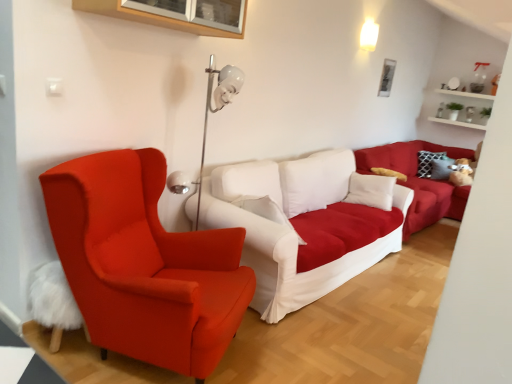
Question: From the image's perspective, does white fabric couch at center, acting as the 2th studio couch starting from the front, appear lower than white wooden shelf at upper right?

Choices:
 (A) no
 (B) yes

Answer: (B)

Question: Does white fabric couch at center, acting as the 2th studio couch starting from the front, have a lesser height compared to white wooden shelf at upper right?

Choices:
 (A) no
 (B) yes

Answer: (A)

Question: Does white fabric couch at center, acting as the 2th studio couch starting from the front, have a greater width compared to white wooden shelf at upper right?

Choices:
 (A) yes
 (B) no

Answer: (A)

Question: Is white fabric couch at center, acting as the 2th studio couch starting from the front, smaller than white wooden shelf at upper right?

Choices:
 (A) no
 (B) yes

Answer: (A)

Question: Could you tell me if white fabric couch at center, the 1th studio couch from the back, is turned towards white wooden shelf at upper right?

Choices:
 (A) no
 (B) yes

Answer: (A)

Question: Is matte orange armchair at left bigger or smaller than metallic silver picture frame at upper center?

Choices:
 (A) big
 (B) small

Answer: (A)

Question: From their relative heights in the image, would you say matte orange armchair at left is taller or shorter than metallic silver picture frame at upper center?

Choices:
 (A) short
 (B) tall

Answer: (B)

Question: From a real-world perspective, is matte orange armchair at left physically located above or below metallic silver picture frame at upper center?

Choices:
 (A) below
 (B) above

Answer: (A)

Question: Does point (69, 175) appear closer or farther from the camera than point (391, 71)?

Choices:
 (A) closer
 (B) farther

Answer: (A)

Question: From a real-world perspective, relative to metallic silver picture frame at upper center, is white fabric couch at center, which ranks as the first studio couch in front-to-back order, vertically above or below?

Choices:
 (A) below
 (B) above

Answer: (A)

Question: Considering the positions of white fabric couch at center, the 2th studio couch viewed from the back, and metallic silver picture frame at upper center in the image, is white fabric couch at center, the 2th studio couch viewed from the back, taller or shorter than metallic silver picture frame at upper center?

Choices:
 (A) tall
 (B) short

Answer: (A)

Question: In terms of size, does white fabric couch at center, which ranks as the first studio couch in front-to-back order, appear bigger or smaller than metallic silver picture frame at upper center?

Choices:
 (A) small
 (B) big

Answer: (B)

Question: Based on their positions, is white fabric couch at center, the 2th studio couch viewed from the back, located to the left or right of metallic silver picture frame at upper center?

Choices:
 (A) right
 (B) left

Answer: (B)

Question: From the image's perspective, is matte orange armchair at left positioned above or below white fabric couch at center, the 2th studio couch viewed from the back?

Choices:
 (A) below
 (B) above

Answer: (A)

Question: Considering the positions of matte orange armchair at left and white fabric couch at center, the 2th studio couch viewed from the back, in the image, is matte orange armchair at left bigger or smaller than white fabric couch at center, the 2th studio couch viewed from the back,?

Choices:
 (A) small
 (B) big

Answer: (A)